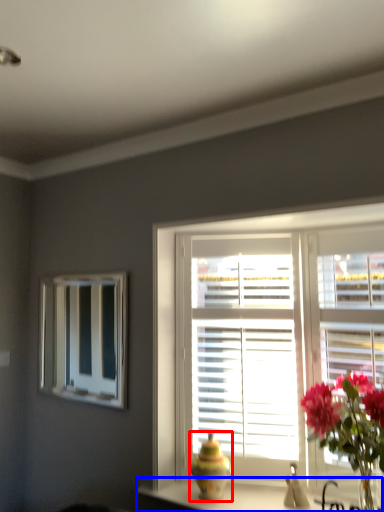
Question: Which object appears closest to the camera in this image, vase (highlighted by a red box) or counter top (highlighted by a blue box)?

Choices:
 (A) vase
 (B) counter top

Answer: (B)